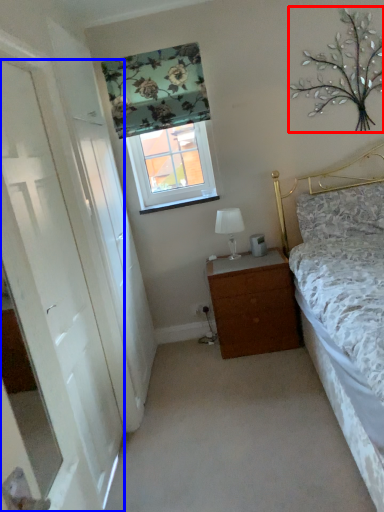
Question: Among these objects, which one is farthest to the camera, tree (highlighted by a red box) or door (highlighted by a blue box)?

Choices:
 (A) tree
 (B) door

Answer: (A)